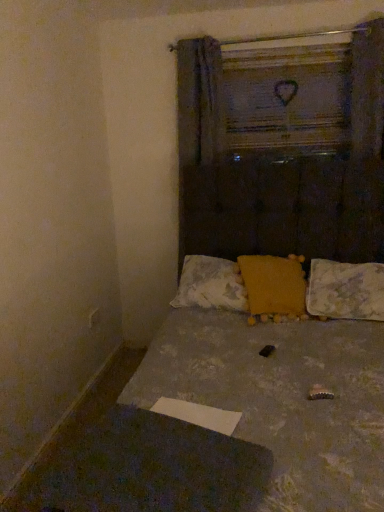
Question: From the image's perspective, does yellow fabric pillow at center, placed as the 3th pillow when sorted from right to left, appear lower than yellow fuzzy pillow at center, which ranks as the 2th pillow in left-to-right order?

Choices:
 (A) no
 (B) yes

Answer: (A)

Question: Is yellow fabric pillow at center, which is counted as the 1th pillow, starting from the left, to the right of yellow fuzzy pillow at center, which ranks as the second pillow in right-to-left order, from the viewer's perspective?

Choices:
 (A) no
 (B) yes

Answer: (A)

Question: From a real-world perspective, is yellow fabric pillow at center, placed as the 3th pillow when sorted from right to left, on top of yellow fuzzy pillow at center, which ranks as the 2th pillow in left-to-right order?

Choices:
 (A) no
 (B) yes

Answer: (A)

Question: Is yellow fabric pillow at center, placed as the 3th pillow when sorted from right to left, directly adjacent to yellow fuzzy pillow at center, which ranks as the 2th pillow in left-to-right order?

Choices:
 (A) yes
 (B) no

Answer: (B)

Question: From a real-world perspective, is yellow fabric pillow at center, which is counted as the 1th pillow, starting from the left, below yellow fuzzy pillow at center, which ranks as the second pillow in right-to-left order?

Choices:
 (A) no
 (B) yes

Answer: (B)

Question: From a real-world perspective, is wooden frame at upper center positioned above or below yellow fabric pillow at center, which is counted as the 1th pillow, starting from the left?

Choices:
 (A) above
 (B) below

Answer: (A)

Question: Would you say wooden frame at upper center is to the left or to the right of yellow fabric pillow at center, which is counted as the 1th pillow, starting from the left, in the picture?

Choices:
 (A) right
 (B) left

Answer: (A)

Question: Is wooden frame at upper center in front of or behind yellow fabric pillow at center, placed as the 3th pillow when sorted from right to left, in the image?

Choices:
 (A) behind
 (B) front

Answer: (A)

Question: Which is correct: wooden frame at upper center is inside yellow fabric pillow at center, which is counted as the 1th pillow, starting from the left, or outside of it?

Choices:
 (A) inside
 (B) outside

Answer: (B)

Question: Looking at the image, does yellow fuzzy pillow at center, which ranks as the second pillow in right-to-left order, seem bigger or smaller compared to wooden frame at upper center?

Choices:
 (A) big
 (B) small

Answer: (A)

Question: Considering the positions of point (253, 304) and point (274, 118), is point (253, 304) closer or farther from the camera than point (274, 118)?

Choices:
 (A) closer
 (B) farther

Answer: (A)

Question: Would you say yellow fuzzy pillow at center, which ranks as the second pillow in right-to-left order, is to the left or to the right of wooden frame at upper center in the picture?

Choices:
 (A) right
 (B) left

Answer: (B)

Question: Relative to wooden frame at upper center, is yellow fuzzy pillow at center, which ranks as the 2th pillow in left-to-right order, in front or behind?

Choices:
 (A) behind
 (B) front

Answer: (B)

Question: From the image's perspective, is yellow fabric pillow at center, which is counted as the 1th pillow, starting from the left, above or below wooden frame at upper center?

Choices:
 (A) below
 (B) above

Answer: (A)

Question: Does point (226, 290) appear closer or farther from the camera than point (286, 125)?

Choices:
 (A) closer
 (B) farther

Answer: (A)